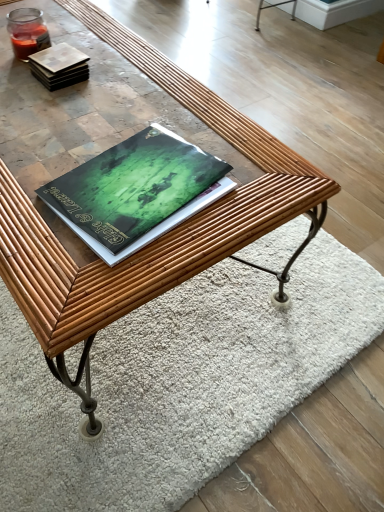
Question: Relative to rug at center, is green matte book at center, which is counted as the first book, starting from the front, in front or behind?

Choices:
 (A) front
 (B) behind

Answer: (A)

Question: Considering the positions of green matte book at center, the 2th book viewed from the top, and rug at center in the image, is green matte book at center, the 2th book viewed from the top, bigger or smaller than rug at center?

Choices:
 (A) big
 (B) small

Answer: (B)

Question: Which of these objects is positioned farthest from the green matte book at center, acting as the second book starting from the back?

Choices:
 (A) rug at center
 (B) matte brown tile at upper left, arranged as the 2th book when viewed from the front

Answer: (A)

Question: Which object is the farthest from the rug at center?

Choices:
 (A) green matte book at center, the 1th book ordered from the bottom
 (B) matte brown tile at upper left, arranged as the 2th book when viewed from the front

Answer: (B)